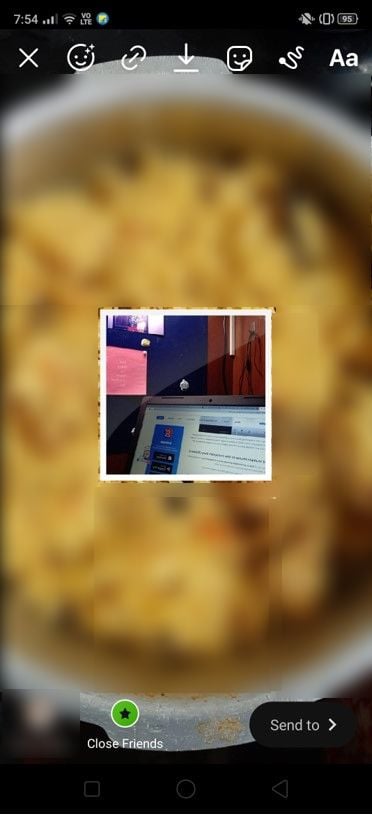
You are a GUI agent. You are given a task and a screenshot of the screen. Output one action in this format:
    pyautogui.click(x=<x>, y=<y>)
    Task: Click on the white square frame
    
    Given the screenshot: What is the action you would take?
    pyautogui.click(x=195, y=313)